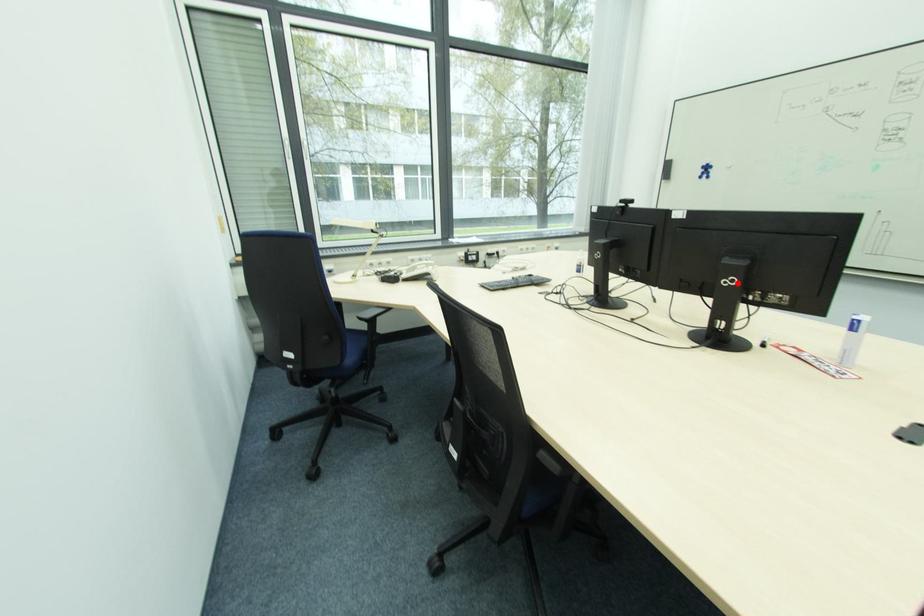
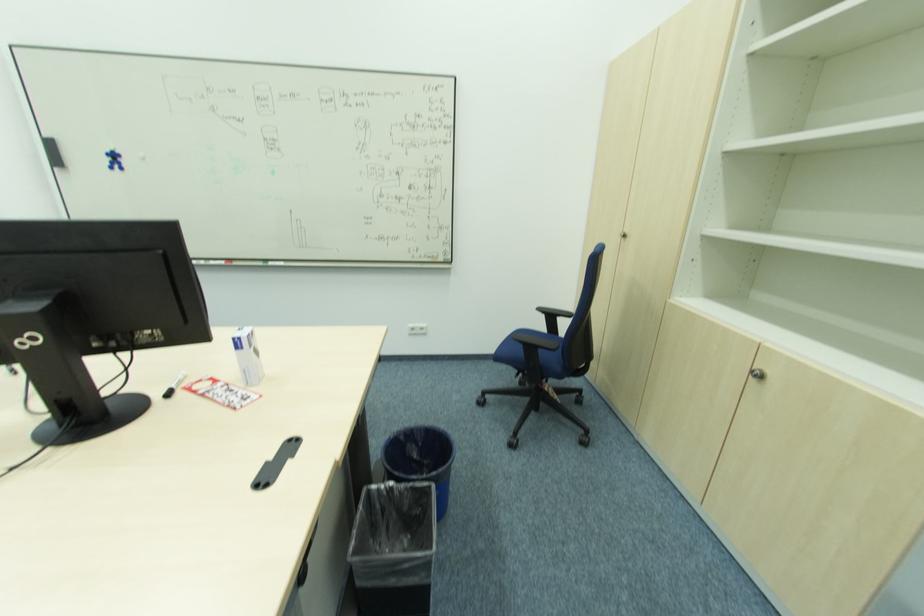
Where in the second image is the point corresponding to the highlighted location from the first image?

(42, 341)